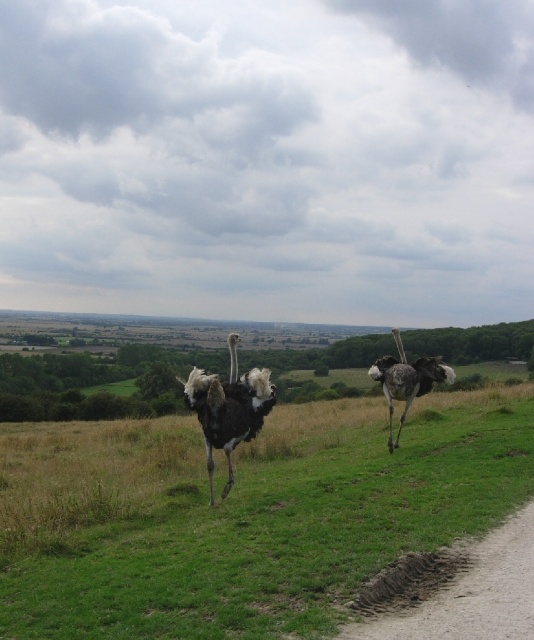
Who is positioned more to the left, green grassy at center or dirt/gravel path at lower right?

green grassy at center

Does point (260, 579) lie behind point (399, 595)?

Yes, it is.

At what (x,y) coordinates should I click in order to perform the action: click on green grassy at center. Please return your answer as a coordinate pair (x, y). The height and width of the screenshot is (640, 534). Looking at the image, I should click on (245, 513).

Is green grassy at center thinner than black feathered ostrich at center?

In fact, green grassy at center might be wider than black feathered ostrich at center.

Which of these two, green grassy at center or black feathered ostrich at center, stands taller?

green grassy at center

Who is more forward, (x=159, y=608) or (x=225, y=403)?

Point (x=159, y=608) is more forward.

The image size is (534, 640). I want to click on green grassy at center, so click(245, 513).

Can you confirm if green grassy at center is positioned to the right of dark grey feathered ostrich at right?

In fact, green grassy at center is to the left of dark grey feathered ostrich at right.

Between point (219, 636) and point (388, 356), which one is positioned in front?

Positioned in front is point (219, 636).

You are a GUI agent. You are given a task and a screenshot of the screen. Output one action in this format:
    pyautogui.click(x=<x>, y=<y>)
    Task: Click on the green grassy at center
    The width and height of the screenshot is (534, 640).
    Given the screenshot: What is the action you would take?
    pyautogui.click(x=245, y=513)